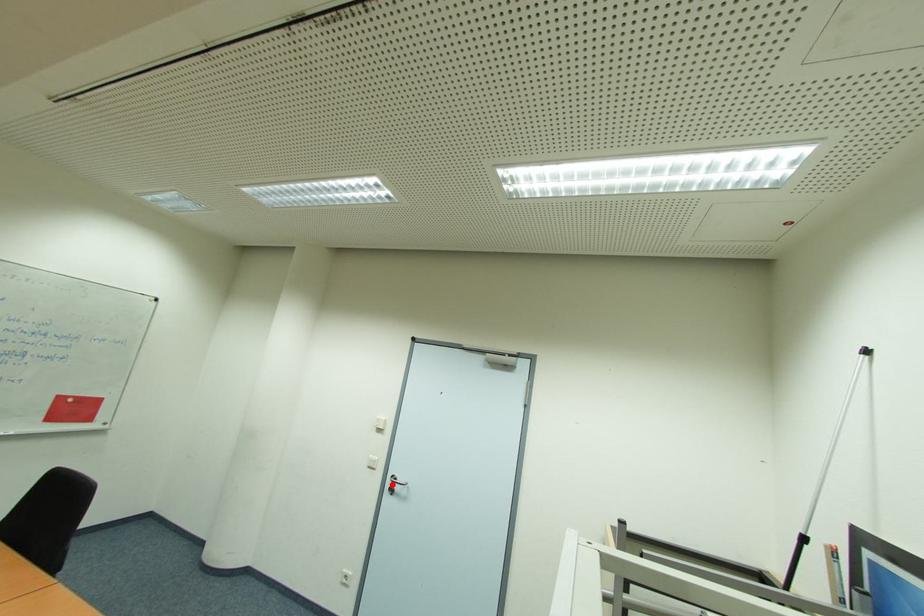
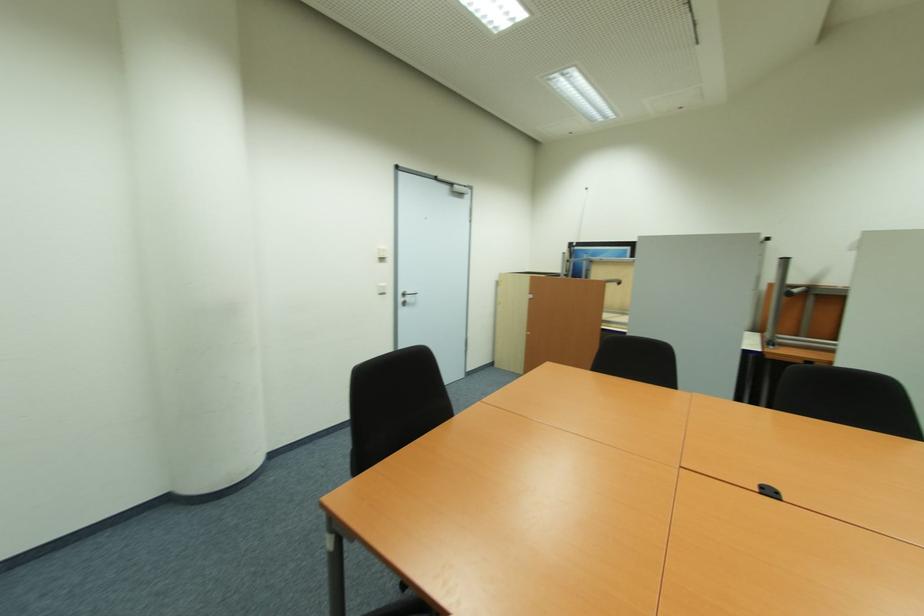
The point at the highlighted location is marked in the first image. Where is the corresponding point in the second image?

(405, 300)